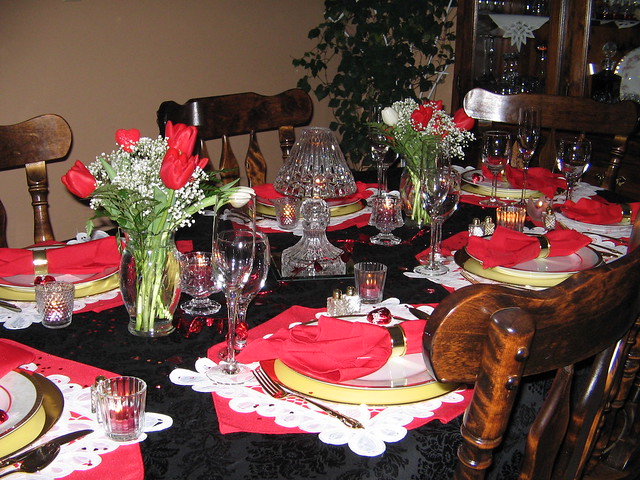
At what (x,y) coordinates should I click in order to perform the action: click on silverware. Please return your answer as a coordinate pair (x, y). The height and width of the screenshot is (480, 640). Looking at the image, I should click on (73, 438), (44, 464), (267, 382), (420, 313), (602, 250), (470, 280).